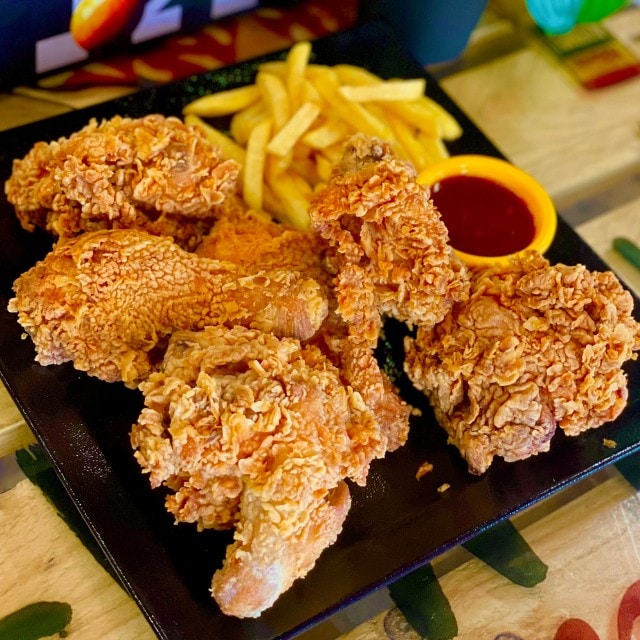
Where is `black plate`? This screenshot has height=640, width=640. black plate is located at coordinates (369, 547).